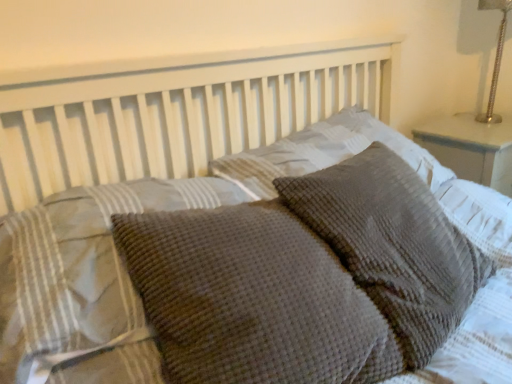
Question: Which direction should I rotate to look at waffle-textured gray pillow at center, the 1th pillow viewed from the left?

Choices:
 (A) right
 (B) left

Answer: (B)

Question: From the image's perspective, does silver metallic lamp at upper right appear lower than waffle-textured gray pillow at center, the fourth pillow viewed from the left?

Choices:
 (A) yes
 (B) no

Answer: (B)

Question: From a real-world perspective, is silver metallic lamp at upper right positioned under waffle-textured gray pillow at center, the fourth pillow viewed from the left, based on gravity?

Choices:
 (A) no
 (B) yes

Answer: (A)

Question: Can you confirm if silver metallic lamp at upper right is wider than waffle-textured gray pillow at center, which is counted as the 1th pillow, starting from the right?

Choices:
 (A) yes
 (B) no

Answer: (B)

Question: Are silver metallic lamp at upper right and waffle-textured gray pillow at center, the fourth pillow viewed from the left, far apart?

Choices:
 (A) no
 (B) yes

Answer: (B)

Question: Is silver metallic lamp at upper right oriented towards waffle-textured gray pillow at center, which is counted as the 1th pillow, starting from the right?

Choices:
 (A) yes
 (B) no

Answer: (B)

Question: Can you confirm if silver metallic lamp at upper right is taller than waffle-textured gray pillow at center, which is counted as the 1th pillow, starting from the right?

Choices:
 (A) yes
 (B) no

Answer: (A)

Question: From the image's perspective, is waffle-textured gray pillow at center, which ranks as the 4th pillow in right-to-left order, above waffle-textured gray pillow at center, the fourth pillow viewed from the left?

Choices:
 (A) no
 (B) yes

Answer: (A)

Question: Considering the relative sizes of waffle-textured gray pillow at center, which ranks as the 4th pillow in right-to-left order, and waffle-textured gray pillow at center, the fourth pillow viewed from the left, in the image provided, is waffle-textured gray pillow at center, which ranks as the 4th pillow in right-to-left order, thinner than waffle-textured gray pillow at center, the fourth pillow viewed from the left,?

Choices:
 (A) yes
 (B) no

Answer: (A)

Question: Considering the relative sizes of waffle-textured gray pillow at center, which ranks as the 4th pillow in right-to-left order, and waffle-textured gray pillow at center, the fourth pillow viewed from the left, in the image provided, is waffle-textured gray pillow at center, which ranks as the 4th pillow in right-to-left order, taller than waffle-textured gray pillow at center, the fourth pillow viewed from the left,?

Choices:
 (A) yes
 (B) no

Answer: (B)

Question: Is waffle-textured gray pillow at center, which ranks as the 4th pillow in right-to-left order, outside of waffle-textured gray pillow at center, the fourth pillow viewed from the left?

Choices:
 (A) yes
 (B) no

Answer: (A)

Question: Is waffle-textured gray pillow at center, the 1th pillow viewed from the left, smaller than waffle-textured gray pillow at center, the fourth pillow viewed from the left?

Choices:
 (A) yes
 (B) no

Answer: (A)

Question: Is waffle-textured gray pillow at center, which ranks as the 4th pillow in right-to-left order, oriented towards waffle-textured gray pillow at center, which is counted as the 1th pillow, starting from the right?

Choices:
 (A) yes
 (B) no

Answer: (B)

Question: Is waffle-textured gray pillow at center, the third pillow viewed from the left, facing away from waffle-textured gray pillow at center, the fourth pillow viewed from the left?

Choices:
 (A) no
 (B) yes

Answer: (A)